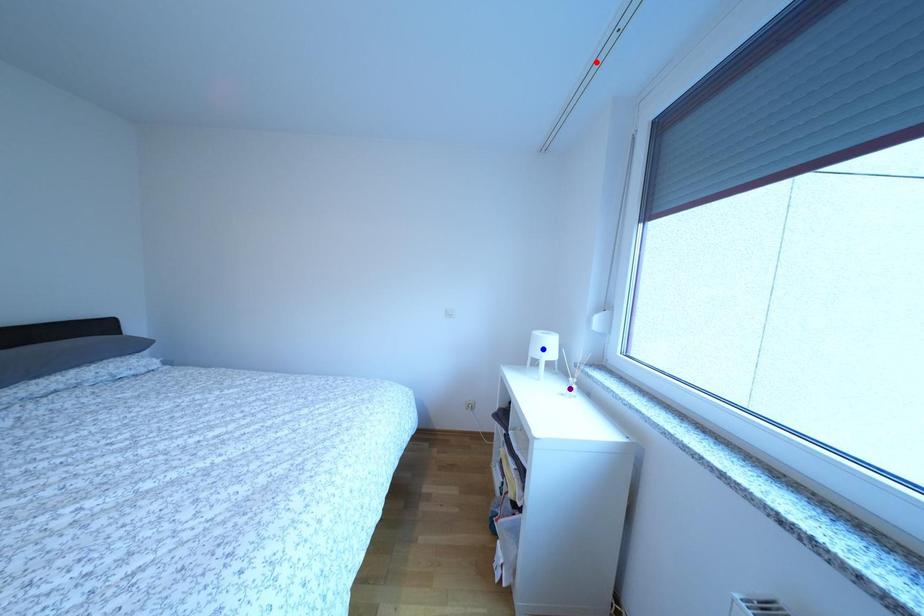
Order these from nearest to farthest:
red point
purple point
blue point

red point → purple point → blue point